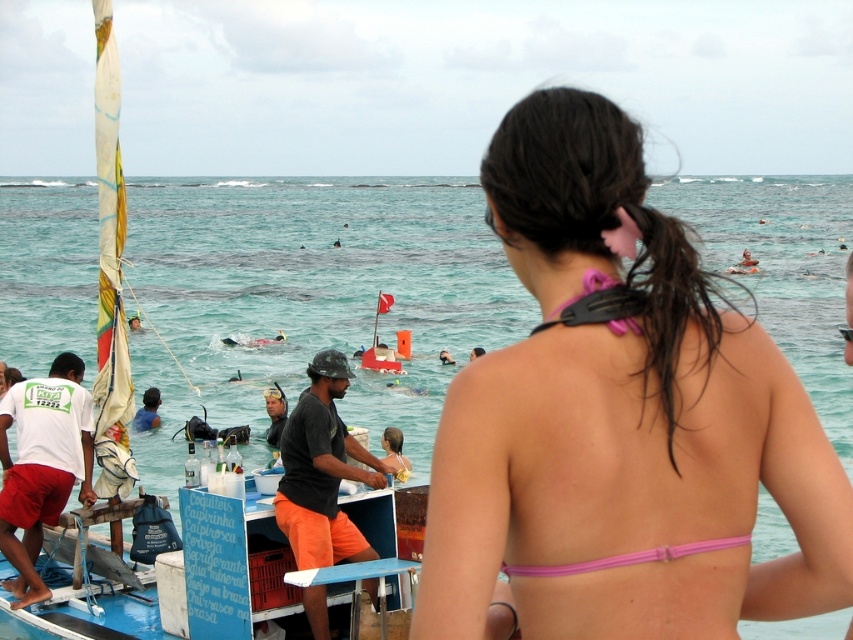
You are a photographer trying to capture both the black matte helmet at center and the pink fabric bikini at back in the same frame. Which object should you focus on first to ensure both are in focus?

You should focus on the black matte helmet at center first because it is closer to the viewer than the pink fabric bikini at back, so focusing on the closer object will help keep both in focus.

You are a snorkeler preparing to dive into the water. You see the clear blue water at center and the black matte helmet at center. Which object is closer to you as you stand on the dock?

The clear blue water at center is closer to you because it is in front of the black matte helmet at center.

You are a photographer taking a picture of the beach scene. You have two points marked on your camera screen at coordinates point (335, 205) and point (340, 362). Which point is closer to your camera lens?

Point (335, 205) is further to the camera than point (340, 362), so the point closer to the camera lens is point (340, 362).